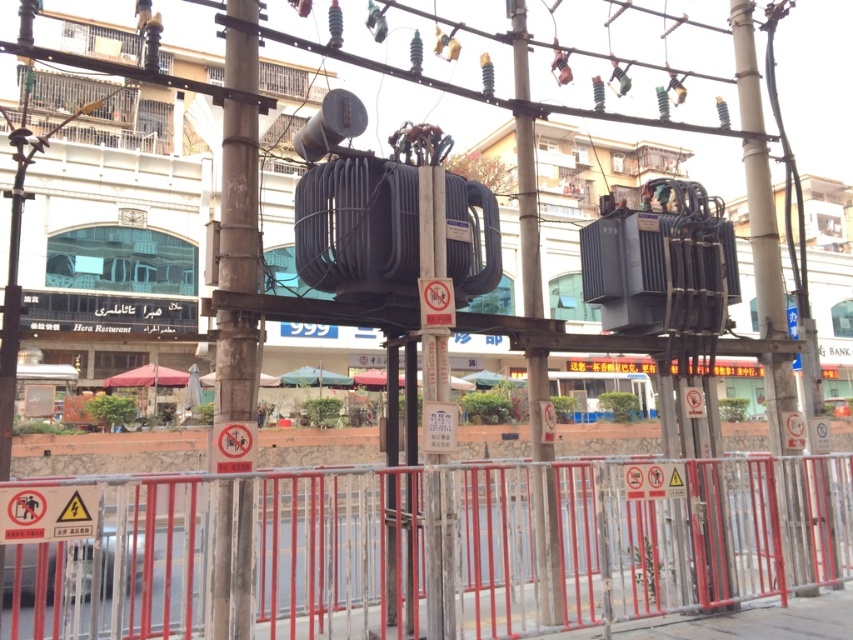
Question: Which point appears closest to the camera in this image?

Choices:
 (A) (747, 99)
 (B) (556, 561)
 (C) (573, 520)
 (D) (259, 259)

Answer: (D)

Question: Which point is closer to the camera taking this photo?

Choices:
 (A) (546, 522)
 (B) (753, 172)

Answer: (A)

Question: Which of the following is the farthest from the observer?

Choices:
 (A) (248, 609)
 (B) (763, 257)
 (C) (525, 109)

Answer: (B)

Question: Is metallic silver fence at lower center smaller than smooth beige pole at right?

Choices:
 (A) yes
 (B) no

Answer: (A)

Question: Is metallic silver fence at lower center thinner than metallic gray transformer at center?

Choices:
 (A) yes
 (B) no

Answer: (A)

Question: Is metallic silver fence at lower center above rusty metal pole at center?

Choices:
 (A) yes
 (B) no

Answer: (B)